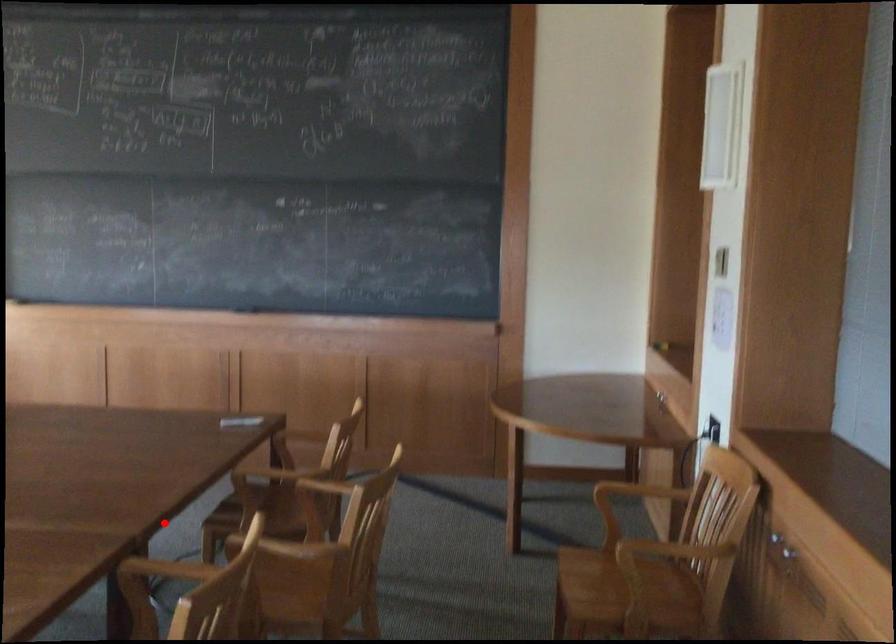
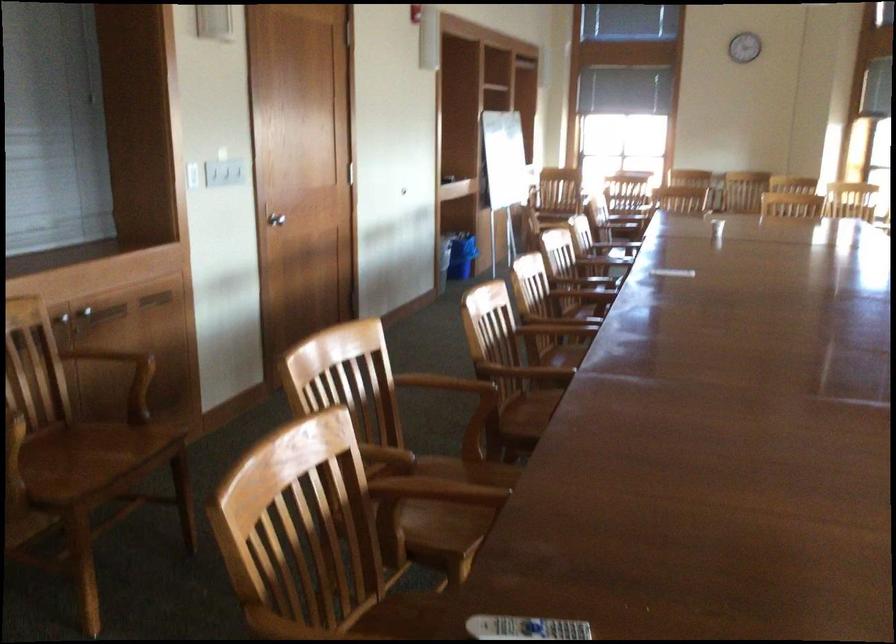
Find the pixel in the second image that matches the highlighted location in the first image.

(438, 498)